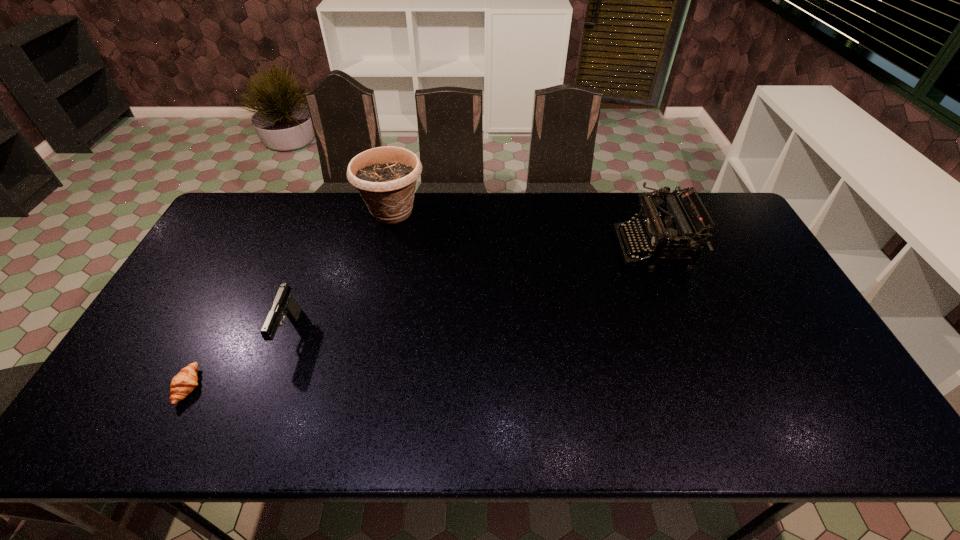
Find the location of a particular element. vacant space located aim along the barrel of the third object from right to left is located at coordinates (251, 440).

Locate an element on the screen. free spot located 0.300m on the front-facing side of the nearest object is located at coordinates (324, 387).

You are a GUI agent. You are given a task and a screenshot of the screen. Output one action in this format:
    pyautogui.click(x=<x>, y=<y>)
    Task: Click on the flowerpot at the far edge
    The height and width of the screenshot is (540, 960).
    Given the screenshot: What is the action you would take?
    pyautogui.click(x=385, y=177)

The image size is (960, 540). Find the location of `typewriter that is positioned at the far edge`. typewriter that is positioned at the far edge is located at coordinates (655, 226).

At what (x,y) coordinates should I click in order to perform the action: click on object that is at the near edge. Please return your answer as a coordinate pair (x, y). The height and width of the screenshot is (540, 960). Looking at the image, I should click on (182, 384).

Locate an element on the screen. Image resolution: width=960 pixels, height=540 pixels. object present at the left edge is located at coordinates (182, 384).

Identify the location of object that is at the near left corner. (182, 384).

The height and width of the screenshot is (540, 960). In the image, there is a desktop. What are the coordinates of `vacant space at the far edge` in the screenshot? It's located at (299, 194).

In the image, there is a desktop. At what (x,y) coordinates should I click in order to perform the action: click on vacant space at the near edge. Please return your answer as a coordinate pair (x, y). The image size is (960, 540). Looking at the image, I should click on click(418, 432).

The width and height of the screenshot is (960, 540). I want to click on blank space at the right edge of the desktop, so click(771, 294).